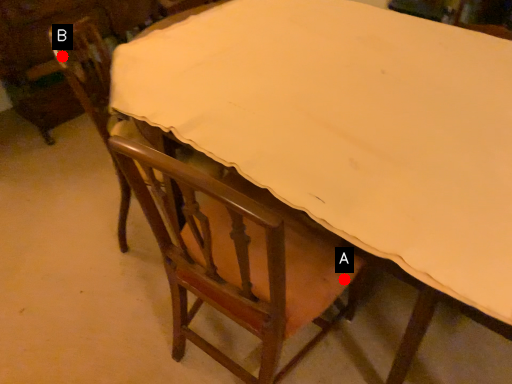
Question: Two points are circled on the image, labeled by A and B beside each circle. Which point is closer to the camera?

Choices:
 (A) A is closer
 (B) B is closer

Answer: (A)